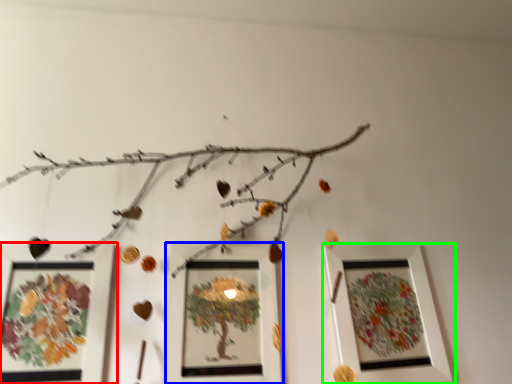
Question: Which object is the closest to the picture frame (highlighted by a red box)? Choose among these: picture frame (highlighted by a blue box) or picture frame (highlighted by a green box).

Choices:
 (A) picture frame
 (B) picture frame

Answer: (A)